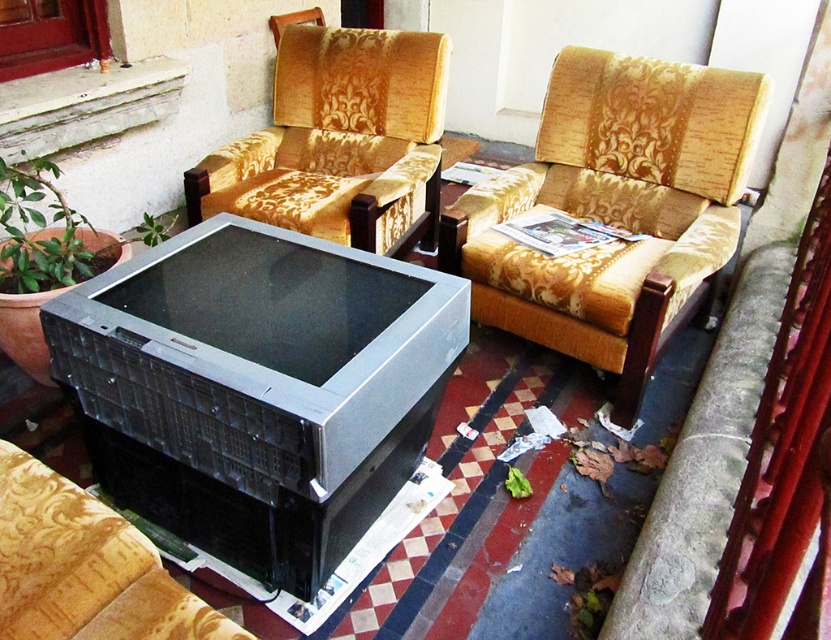
Identify the location of gold patterned fabric armchair at center. Image resolution: width=831 pixels, height=640 pixels. (613, 209).

Who is higher up, gold patterned fabric armchair at center or black plastic tv at center?

gold patterned fabric armchair at center is higher up.

Between point (618, 172) and point (210, 624), which one is positioned behind?

Positioned behind is point (618, 172).

You are a GUI agent. You are given a task and a screenshot of the screen. Output one action in this format:
    pyautogui.click(x=<x>, y=<y>)
    Task: Click on the gold patterned fabric armchair at center
    Image resolution: width=831 pixels, height=640 pixels.
    Given the screenshot: What is the action you would take?
    pyautogui.click(x=613, y=209)

Can you confirm if gold patterned armchair at upper center is positioned below black plastic tv at center?

No.

Which is in front, point (359, 90) or point (33, 579)?

Point (33, 579)

Who is more distant from viewer, [446,58] or [53,616]?

The point [446,58] is behind.

This screenshot has height=640, width=831. Identify the location of gold patterned armchair at upper center. (340, 141).

Can you confirm if gold patterned fabric armchair at center is smaller than gold patterned armchair at upper center?

No, gold patterned fabric armchair at center is not smaller than gold patterned armchair at upper center.

What do you see at coordinates (613, 209) in the screenshot?
I see `gold patterned fabric armchair at center` at bounding box center [613, 209].

This screenshot has height=640, width=831. Describe the element at coordinates (613, 209) in the screenshot. I see `gold patterned fabric armchair at center` at that location.

You are a GUI agent. You are given a task and a screenshot of the screen. Output one action in this format:
    pyautogui.click(x=<x>, y=<y>)
    Task: Click on the gold patterned fabric armchair at center
    The image size is (831, 640).
    Given the screenshot: What is the action you would take?
    pyautogui.click(x=613, y=209)